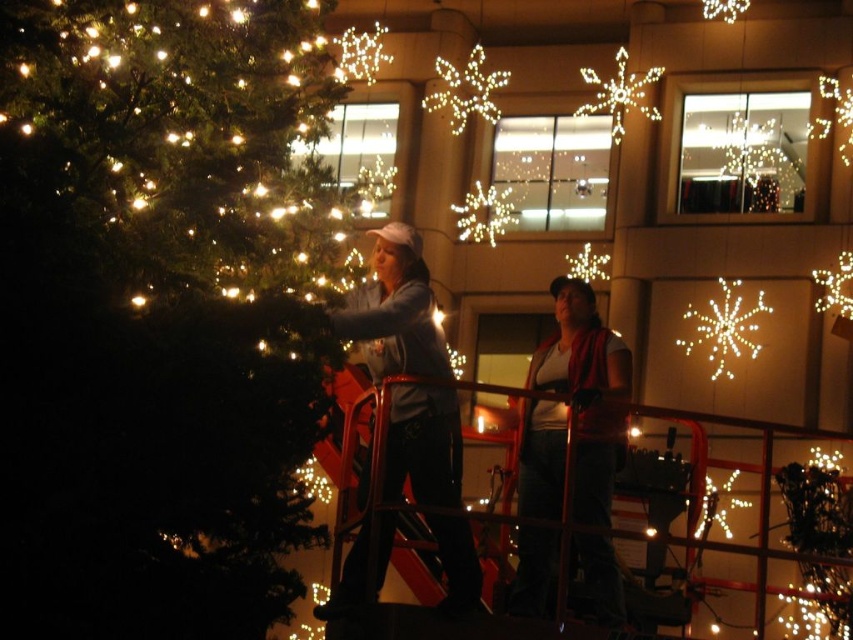
Between point (546, 428) and point (590, 72), which one is positioned behind?

Point (590, 72)

Is matte white tank top at center smaller than illuminated plastic snowflake at upper center?

Incorrect, matte white tank top at center is not smaller in size than illuminated plastic snowflake at upper center.

Identify the location of matte white tank top at center. (585, 394).

Is matte gray sweater at center above illuminated plastic snowflake at upper center?

Incorrect, matte gray sweater at center is not positioned above illuminated plastic snowflake at upper center.

The width and height of the screenshot is (853, 640). What do you see at coordinates (395, 310) in the screenshot?
I see `matte gray sweater at center` at bounding box center [395, 310].

What do you see at coordinates (395, 310) in the screenshot?
I see `matte gray sweater at center` at bounding box center [395, 310].

This screenshot has height=640, width=853. Identify the location of matte gray sweater at center. 395,310.

Is matte white tank top at center to the left of illuminated plastic snowflake at upper right from the viewer's perspective?

Yes, matte white tank top at center is to the left of illuminated plastic snowflake at upper right.

Can you confirm if matte white tank top at center is shorter than illuminated plastic snowflake at upper right?

No.

Between point (598, 369) and point (727, 349), which one is positioned in front?

Point (598, 369) is in front.

Where is `matte white tank top at center`? matte white tank top at center is located at coordinates (585, 394).